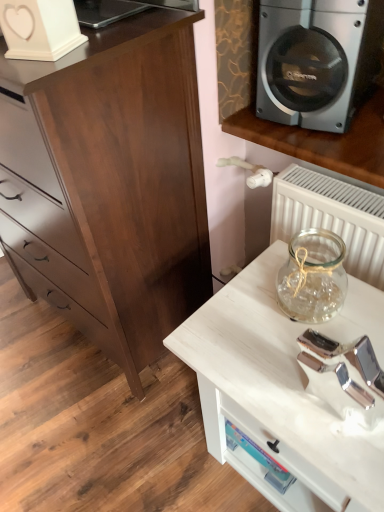
Question: Does silver metallic speaker at upper right have a greater width compared to white wood table at lower right?

Choices:
 (A) no
 (B) yes

Answer: (A)

Question: Is silver metallic speaker at upper right positioned beyond the bounds of white wood table at lower right?

Choices:
 (A) no
 (B) yes

Answer: (B)

Question: From the image's perspective, is silver metallic speaker at upper right on top of white wood table at lower right?

Choices:
 (A) no
 (B) yes

Answer: (B)

Question: Would you say silver metallic speaker at upper right is a long distance from white wood table at lower right?

Choices:
 (A) no
 (B) yes

Answer: (A)

Question: Could you tell me if silver metallic speaker at upper right is facing white wood table at lower right?

Choices:
 (A) no
 (B) yes

Answer: (A)

Question: From the image's perspective, is silver metallic speaker at upper right above or below dark wood chest of drawers at left?

Choices:
 (A) above
 (B) below

Answer: (A)

Question: From a real-world perspective, relative to dark wood chest of drawers at left, is silver metallic speaker at upper right vertically above or below?

Choices:
 (A) below
 (B) above

Answer: (B)

Question: Is silver metallic speaker at upper right inside or outside of dark wood chest of drawers at left?

Choices:
 (A) outside
 (B) inside

Answer: (A)

Question: From their relative heights in the image, would you say silver metallic speaker at upper right is taller or shorter than dark wood chest of drawers at left?

Choices:
 (A) short
 (B) tall

Answer: (A)

Question: Is white matte heart-shaped object at upper left to the left or to the right of white wood table at lower right in the image?

Choices:
 (A) right
 (B) left

Answer: (B)

Question: Considering the positions of point (29, 55) and point (231, 402), is point (29, 55) closer or farther from the camera than point (231, 402)?

Choices:
 (A) closer
 (B) farther

Answer: (A)

Question: Which is correct: white matte heart-shaped object at upper left is inside white wood table at lower right, or outside of it?

Choices:
 (A) outside
 (B) inside

Answer: (A)

Question: From the image's perspective, relative to white wood table at lower right, is white matte heart-shaped object at upper left above or below?

Choices:
 (A) below
 (B) above

Answer: (B)

Question: From the image's perspective, is white matte heart-shaped object at upper left located above or below silver metallic speaker at upper right?

Choices:
 (A) above
 (B) below

Answer: (B)

Question: Considering the positions of point (x=18, y=54) and point (x=283, y=98), is point (x=18, y=54) closer or farther from the camera than point (x=283, y=98)?

Choices:
 (A) closer
 (B) farther

Answer: (A)